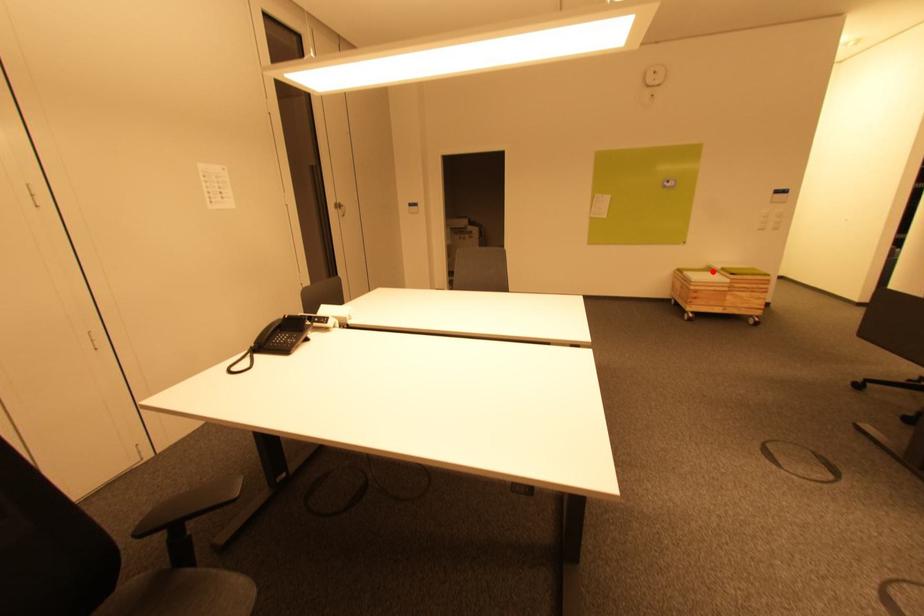
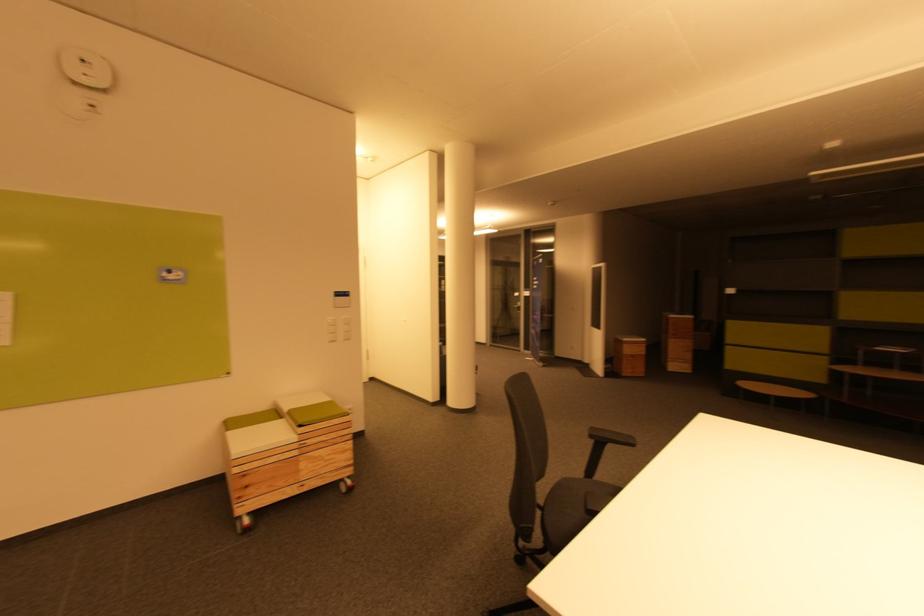
In the second image, find the point that corresponds to the highlighted location in the first image.

(277, 416)